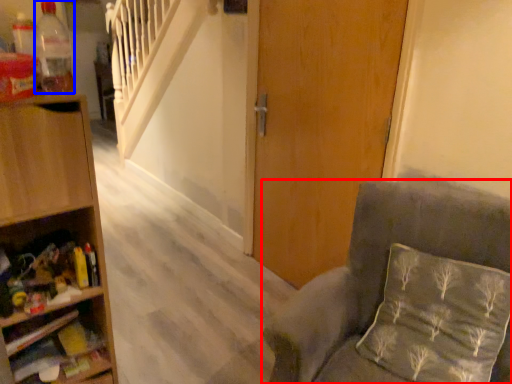
Question: Which point is closer to the camera, chair (highlighted by a red box) or bottle (highlighted by a blue box)?

Choices:
 (A) chair
 (B) bottle

Answer: (A)